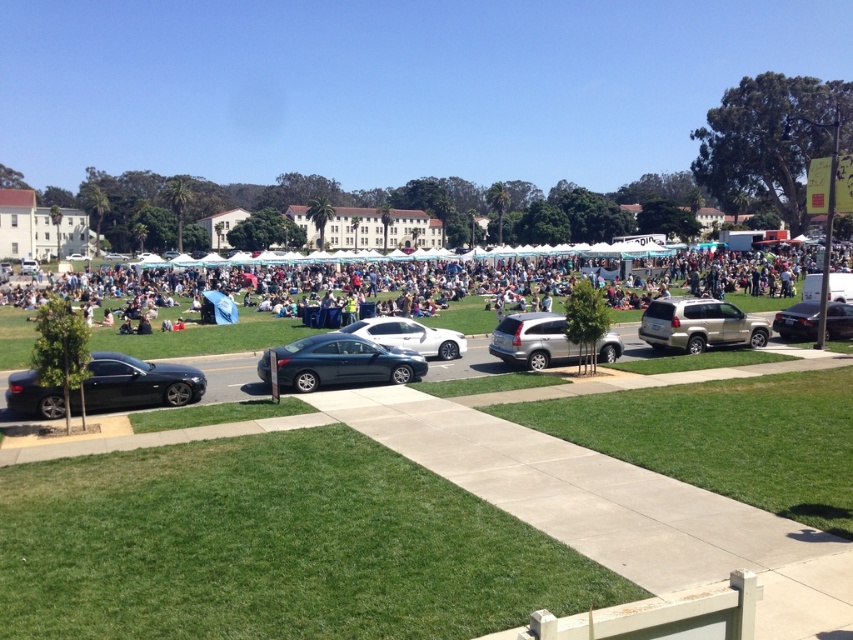
Question: Is shiny black car at lower left thinner than satin black sedan at right?

Choices:
 (A) no
 (B) yes

Answer: (A)

Question: Is shiny black car at lower left to the right of satin silver suv at center from the viewer's perspective?

Choices:
 (A) yes
 (B) no

Answer: (B)

Question: Which of the following is the farthest from the observer?

Choices:
 (A) shiny black car at lower left
 (B) metallic silver car at lower left
 (C) multicolored fabric tents at center
 (D) gold metallic suv at center-right

Answer: (D)

Question: Which object is closer to the camera taking this photo?

Choices:
 (A) satin dark blue sedan at center
 (B) satin black sedan at right
 (C) satin silver suv at center

Answer: (A)

Question: Estimate the real-world distances between objects in this image. Which object is farther from the metallic silver car at lower left?

Choices:
 (A) satin dark blue sedan at center
 (B) satin silver suv at center
 (C) shiny black car at lower left

Answer: (B)

Question: Observing the image, what is the correct spatial positioning of metallic silver car at lower left in reference to satin silver suv at center?

Choices:
 (A) below
 (B) above

Answer: (A)